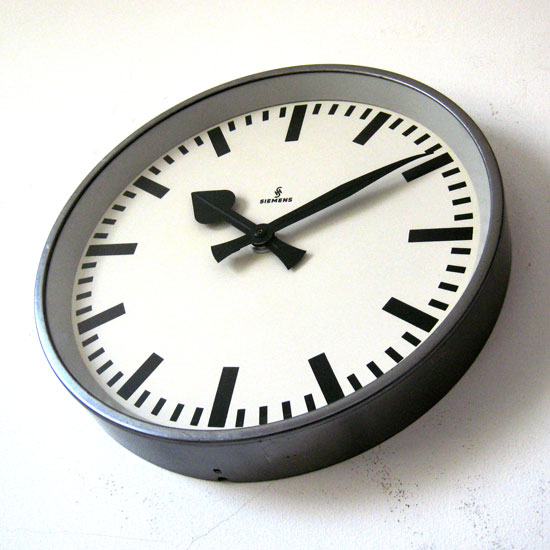
At what (x,y) coordinates should I click in order to perform the action: click on clock. Please return your answer as a coordinate pair (x, y). Looking at the image, I should click on (309, 140).